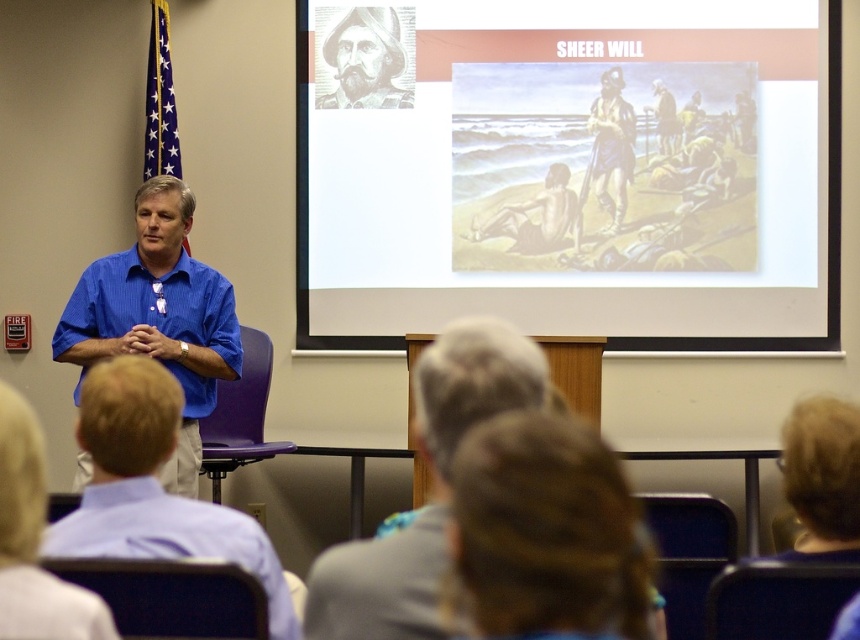
Who is shorter, gray textured portrait at upper center or brown textured jacket at upper center?

brown textured jacket at upper center is shorter.

Can you confirm if gray textured portrait at upper center is positioned above brown textured jacket at upper center?

Yes, gray textured portrait at upper center is above brown textured jacket at upper center.

Measure the distance between point (347,35) and camera.

Point (347,35) and camera are 5.24 meters apart.

In order to click on gray textured portrait at upper center in this screenshot , I will do `click(361, 61)`.

Who is more distant from viewer, (161, 211) or (398, 104)?

Point (398, 104)

Which is more to the right, blue striped shirt at left or gray textured portrait at upper center?

gray textured portrait at upper center is more to the right.

Identify the location of blue striped shirt at left. (158, 316).

Find the location of a particular element. This screenshot has height=640, width=860. blue striped shirt at left is located at coordinates (158, 316).

Can you confirm if matte paper poster at upper center is shorter than blue shirt at center?

Incorrect, matte paper poster at upper center's height does not fall short of blue shirt at center's.

Between matte paper poster at upper center and blue shirt at center, which one appears on the left side from the viewer's perspective?

From the viewer's perspective, blue shirt at center appears more on the left side.

The height and width of the screenshot is (640, 860). Find the location of `matte paper poster at upper center`. matte paper poster at upper center is located at coordinates (569, 170).

You are a GUI agent. You are given a task and a screenshot of the screen. Output one action in this format:
    pyautogui.click(x=<x>, y=<y>)
    Task: Click on the matte paper poster at upper center
    
    Given the screenshot: What is the action you would take?
    pyautogui.click(x=569, y=170)